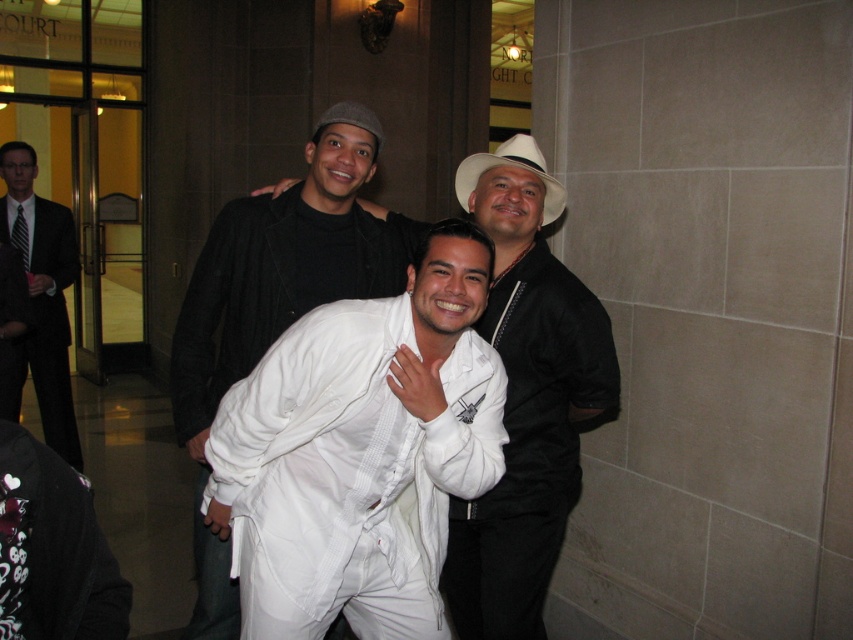
Is white satin shirt at center to the left of white matte jacket at center from the viewer's perspective?

No, white satin shirt at center is not to the left of white matte jacket at center.

Can you confirm if white satin shirt at center is smaller than white matte jacket at center?

Incorrect, white satin shirt at center is not smaller in size than white matte jacket at center.

Is point (523, 211) farther from camera compared to point (300, 252)?

No, (523, 211) is closer to viewer.

The image size is (853, 640). What are the coordinates of `white satin shirt at center` in the screenshot? It's located at (526, 397).

Who is taller, white matte jacket at center or white matte robe at center?

With more height is white matte jacket at center.

Can you confirm if white matte jacket at center is shorter than white matte robe at center?

In fact, white matte jacket at center may be taller than white matte robe at center.

Who is more distant from viewer, (318, 268) or (553, 396)?

Positioned behind is point (553, 396).

Where is `white matte jacket at center`? The image size is (853, 640). white matte jacket at center is located at coordinates 271,305.

Describe the element at coordinates (271, 305) in the screenshot. This screenshot has width=853, height=640. I see `white matte jacket at center` at that location.

Looking at this image, is white matte jacket at center wider than matte black suit at left?

Indeed, white matte jacket at center has a greater width compared to matte black suit at left.

Who is more forward, (316,291) or (55,252)?

Point (316,291)

This screenshot has height=640, width=853. Identify the location of white matte jacket at center. (271, 305).